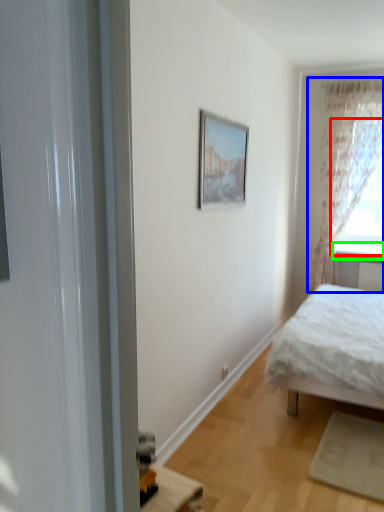
Question: Which object is the closest to the window (highlighted by a red box)? Choose among these: curtain (highlighted by a blue box) or window sill (highlighted by a green box).

Choices:
 (A) curtain
 (B) window sill

Answer: (A)